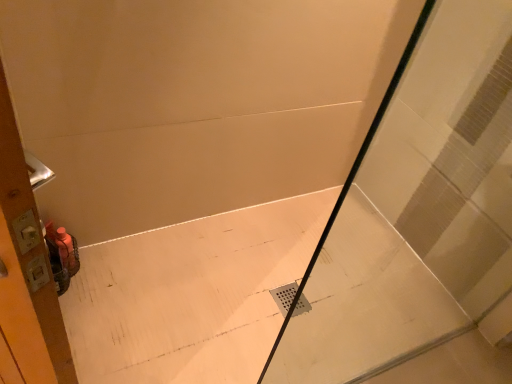
Where is `vacant space underneath transparent glass door at center (from a real-world perspective)`? Image resolution: width=512 pixels, height=384 pixels. vacant space underneath transparent glass door at center (from a real-world perspective) is located at coordinates (408, 362).